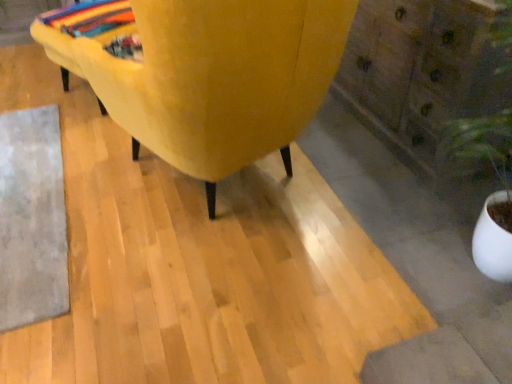
Locate an element on the screen. space that is in front of velvet yellow chair at center is located at coordinates (205, 301).